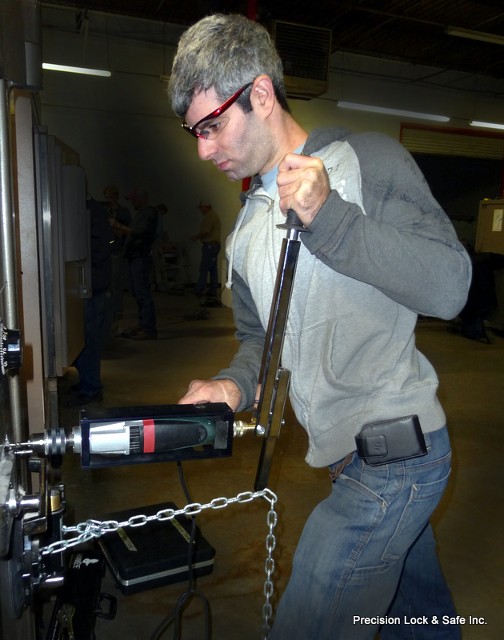
Where is `phone`? The height and width of the screenshot is (640, 504). phone is located at coordinates (406, 448).